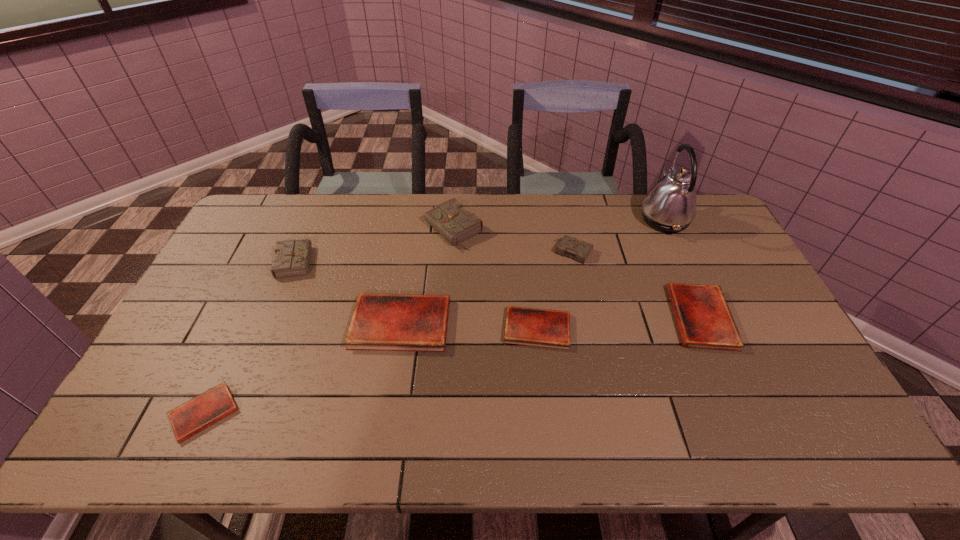
Where is `object that stands as the third closest to the seventh tallest object`? This screenshot has height=540, width=960. object that stands as the third closest to the seventh tallest object is located at coordinates (450, 219).

You are a GUI agent. You are given a task and a screenshot of the screen. Output one action in this format:
    pyautogui.click(x=<x>, y=<y>)
    Task: Click on the diary object that ranks as the closest to the tallest object
    
    Given the screenshot: What is the action you would take?
    pyautogui.click(x=579, y=250)

Choose which diary is the fifth nearest neighbor to the third red diary from left to right. Please provide its 2D coordinates. Your answer should be formatted as a tuple, i.e. [(x, y)], where the tuple contains the x and y coordinates of a point satisfying the conditions above.

[(292, 258)]

Image resolution: width=960 pixels, height=540 pixels. Identify the location of green diary that can be found as the second closest to the rightmost red diary. (450, 219).

Point out which green diary is positioned as the nearest to the nearest object. Please provide its 2D coordinates. Your answer should be formatted as a tuple, i.e. [(x, y)], where the tuple contains the x and y coordinates of a point satisfying the conditions above.

[(292, 258)]

Locate which red diary is the second closest to the third shortest object. Please provide its 2D coordinates. Your answer should be formatted as a tuple, i.e. [(x, y)], where the tuple contains the x and y coordinates of a point satisfying the conditions above.

[(385, 322)]

Identify the location of the fourth closest red diary to the smallest green diary. (204, 410).

Find the location of a particular element. The height and width of the screenshot is (540, 960). vacant point that satisfies the following two spatial constraints: 1. on the back side of the nearest red diary; 2. on the left side of the fourth tallest diary is located at coordinates (246, 323).

The image size is (960, 540). Find the location of `free location that satisfies the following two spatial constraints: 1. on the back side of the rightmost green diary; 2. on the left side of the second shortest diary`. free location that satisfies the following two spatial constraints: 1. on the back side of the rightmost green diary; 2. on the left side of the second shortest diary is located at coordinates (529, 252).